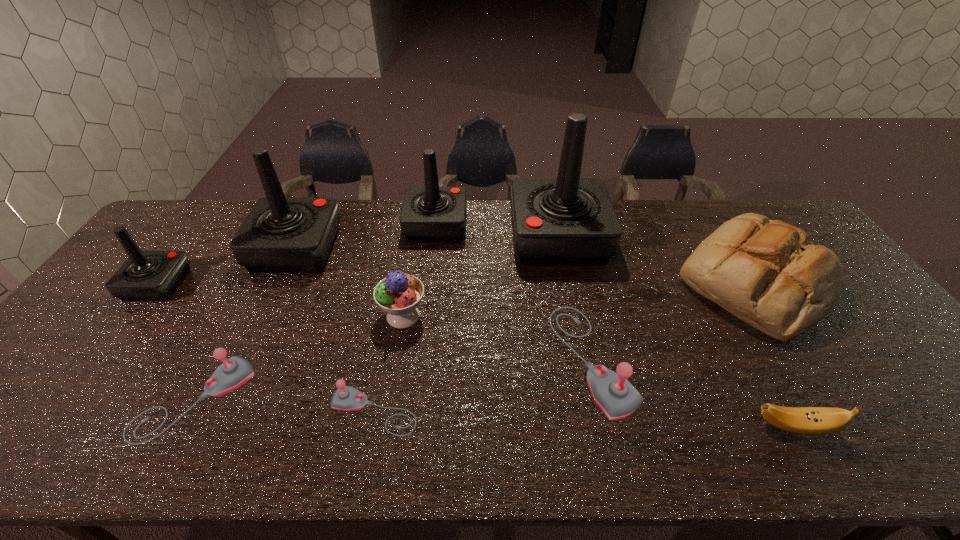
This screenshot has height=540, width=960. In order to click on free space between the icecream and the bread in this screenshot , I will do [579, 300].

The width and height of the screenshot is (960, 540). I want to click on free spot between the banana and the second gray joystick from right to left, so click(584, 419).

The width and height of the screenshot is (960, 540). What are the coordinates of `free area in between the leftmost red joystick and the second smallest gray joystick` in the screenshot? It's located at (177, 342).

The height and width of the screenshot is (540, 960). Identify the location of vacant area that lies between the bread and the second smallest gray joystick. (474, 341).

In order to click on vacant area that lies between the leftmost object and the bread in this screenshot , I will do `click(456, 284)`.

I want to click on free spot between the leftmost gray joystick and the bread, so click(x=474, y=341).

You are a GUI agent. You are given a task and a screenshot of the screen. Output one action in this format:
    pyautogui.click(x=<x>, y=<y>)
    Task: Click on the object that stands as the seventh closest to the tallest joystick
    
    Given the screenshot: What is the action you would take?
    pyautogui.click(x=280, y=234)

What are the coordinates of `object that is the fourth closest to the leftmost joystick` in the screenshot? It's located at (346, 398).

Identify the location of joystick that is the seventh closest to the yellow banana. (146, 275).

You are a GUI agent. You are given a task and a screenshot of the screen. Output one action in this format:
    pyautogui.click(x=<x>, y=<y>)
    Task: Click on the joystick that is the closest to the icecream
    
    Given the screenshot: What is the action you would take?
    pyautogui.click(x=346, y=398)